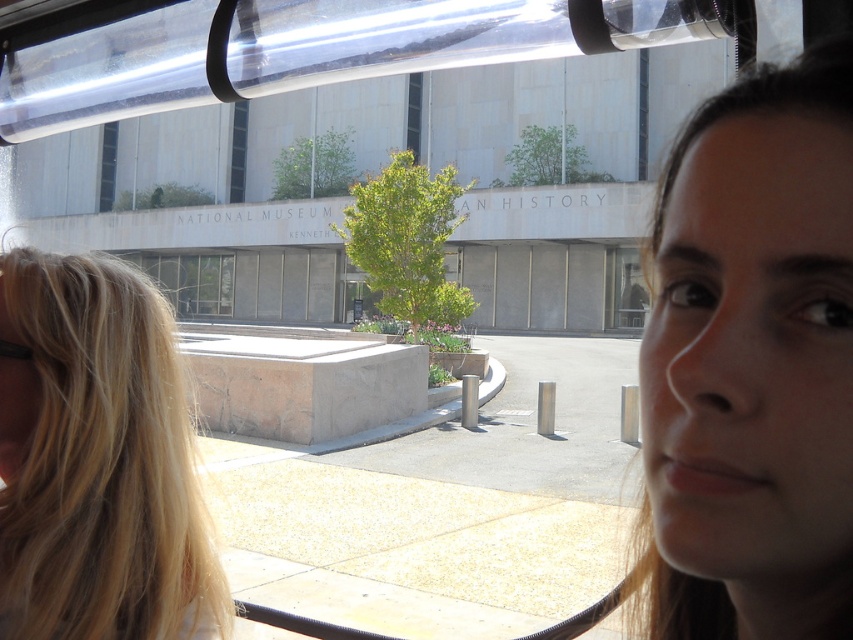
Between point (720, 291) and point (33, 419), which one is positioned behind?

Point (33, 419)

Does smooth skin face at upper right have a larger size compared to blonde hair at left?

No, smooth skin face at upper right is not bigger than blonde hair at left.

You are a GUI agent. You are given a task and a screenshot of the screen. Output one action in this format:
    pyautogui.click(x=<x>, y=<y>)
    Task: Click on the smooth skin face at upper right
    Image resolution: width=853 pixels, height=640 pixels.
    Given the screenshot: What is the action you would take?
    pyautogui.click(x=747, y=328)

Does blonde hair at left have a larger size compared to clear glass window at center?

Incorrect, blonde hair at left is not larger than clear glass window at center.

Does blonde hair at left appear over clear glass window at center?

Incorrect, blonde hair at left is not positioned above clear glass window at center.

Find the location of a particular element. The height and width of the screenshot is (640, 853). blonde hair at left is located at coordinates (97, 460).

Image resolution: width=853 pixels, height=640 pixels. What are the coordinates of `smooth skin face at upper right` in the screenshot? It's located at (747, 328).

Does point (839, 342) lie in front of point (625, 275)?

Yes, it is in front of point (625, 275).

Image resolution: width=853 pixels, height=640 pixels. Identify the location of smooth skin face at upper right. (747, 328).